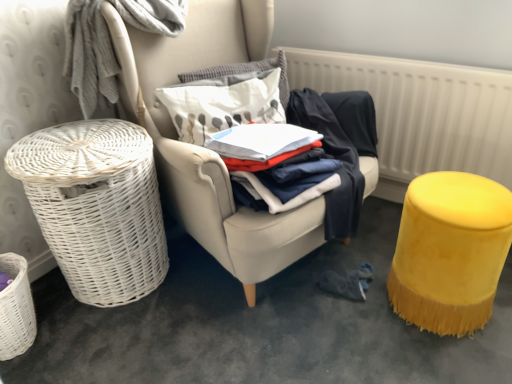
You are a GUI agent. You are given a task and a screenshot of the screen. Output one action in this format:
    pyautogui.click(x=<x>, y=<y>)
    Task: Click on the vacant area located to the right-hand side of white wicker basket at left
    
    Given the screenshot: What is the action you would take?
    pyautogui.click(x=210, y=295)